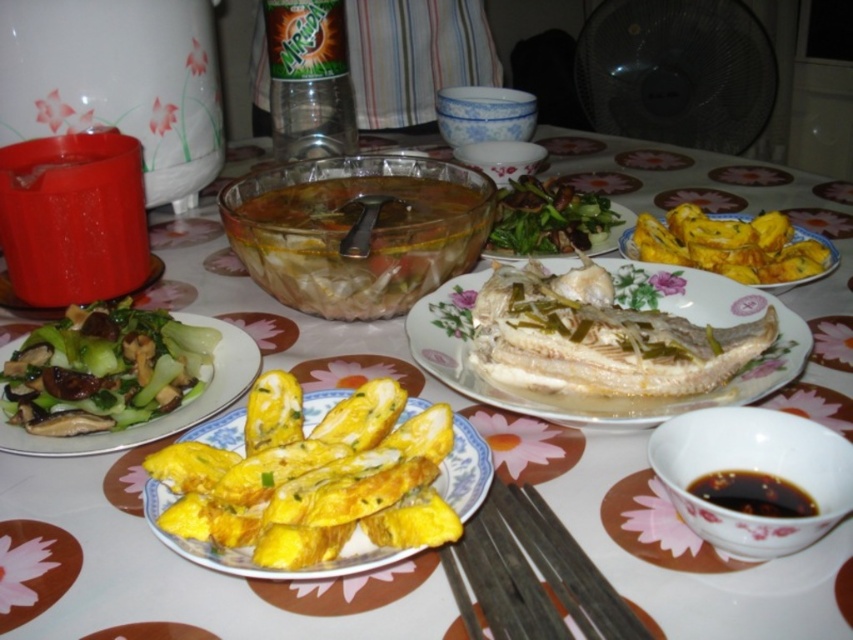
Question: Can you confirm if black wood chopsticks at center is positioned to the right of yellow fried pastry at center?

Choices:
 (A) no
 (B) yes

Answer: (A)

Question: Is yellow fried egg at center in front of green leafy vegetables at center?

Choices:
 (A) yes
 (B) no

Answer: (A)

Question: Where is black wood chopsticks at center located in relation to green matte vegetable at left in the image?

Choices:
 (A) above
 (B) below

Answer: (B)

Question: Which point is closer to the camera?

Choices:
 (A) (28, 440)
 (B) (526, 541)
 (C) (157, 257)
 (D) (764, 250)

Answer: (B)

Question: Which of the following is the farthest from the observer?

Choices:
 (A) (431, 273)
 (B) (584, 616)

Answer: (A)

Question: Which of the following is the farthest from the observer?

Choices:
 (A) (509, 632)
 (B) (786, 248)
 (C) (157, 433)
 (D) (326, 168)

Answer: (D)